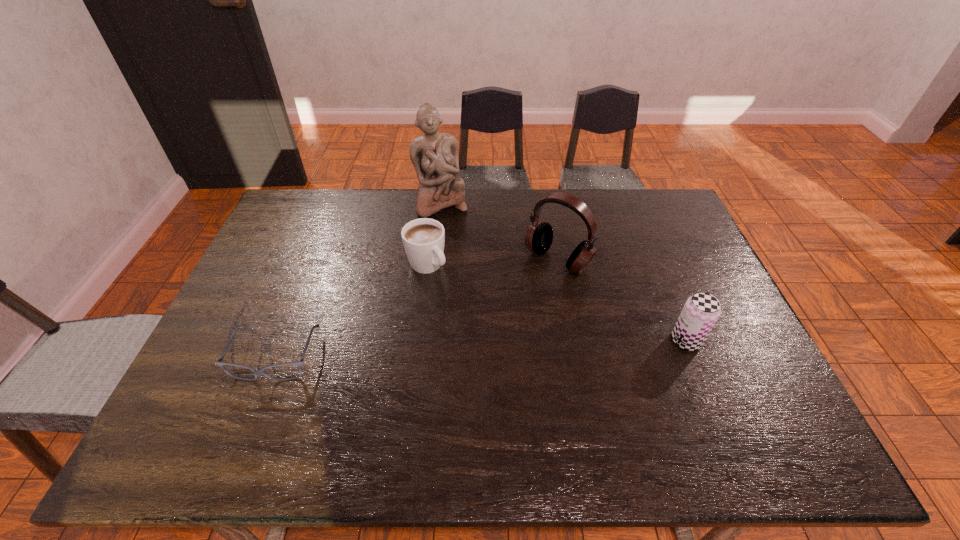
Identify the location of object that is at the near edge. This screenshot has height=540, width=960. (299, 364).

At what (x,y) coordinates should I click in order to perform the action: click on object that is at the left edge. Please return your answer as a coordinate pair (x, y). Looking at the image, I should click on (299, 364).

Where is `object that is at the right edge`? Image resolution: width=960 pixels, height=540 pixels. object that is at the right edge is located at coordinates (701, 311).

Where is `object at the near left corner`? The width and height of the screenshot is (960, 540). object at the near left corner is located at coordinates (299, 364).

You are a GUI agent. You are given a task and a screenshot of the screen. Output one action in this format:
    pyautogui.click(x=<x>, y=<y>)
    Task: Click on the free space at the far edge of the desktop
    
    Given the screenshot: What is the action you would take?
    pyautogui.click(x=324, y=226)

This screenshot has width=960, height=540. In the image, there is a desktop. In order to click on free space at the near edge in this screenshot , I will do `click(386, 400)`.

The height and width of the screenshot is (540, 960). In the image, there is a desktop. Identify the location of free space at the left edge. (247, 297).

Find the location of a particular element. The image size is (960, 540). free space at the right edge of the desktop is located at coordinates (735, 362).

Where is `blank space at the near left corner`? The height and width of the screenshot is (540, 960). blank space at the near left corner is located at coordinates (238, 389).

In order to click on free space at the near right corner of the desktop in this screenshot , I will do `click(719, 406)`.